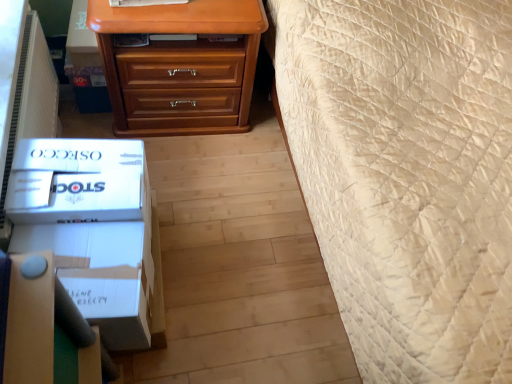
This screenshot has height=384, width=512. I want to click on free space above white cardboard box at lower left, positioned as the 2th box in top-to-bottom order (from a real-world perspective), so click(x=77, y=258).